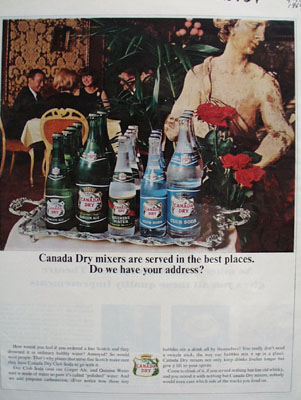
Find the location of `background wall`. background wall is located at coordinates (34, 51).